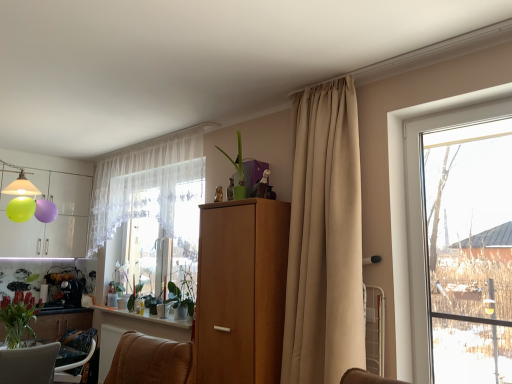
What do you see at coordinates (461, 244) in the screenshot?
I see `transparent glass window at right` at bounding box center [461, 244].

In order to face beige fabric curtain at center, placed as the 2th curtain when sorted from back to front, should I rotate leftwards or rightwards?

You should look right and rotate roughly 7.740 degrees.

The width and height of the screenshot is (512, 384). What do you see at coordinates (324, 239) in the screenshot?
I see `beige fabric curtain at center, the 1th curtain from the front` at bounding box center [324, 239].

Measure the distance between point (31, 304) and camera.

Point (31, 304) and camera are 3.41 meters apart.

Image resolution: width=512 pixels, height=384 pixels. Identify the location of brown leather armchair at lower center, the 2th furniture positioned from the front. (150, 361).

The image size is (512, 384). Find the location of `transparent glass window at right`. transparent glass window at right is located at coordinates (461, 244).

Between brown leather armchair at lower center, the 2th furniture positioned from the front, and translucent fabric at center, which one has larger size?

A: translucent fabric at center is bigger.

Can we say brown leather armchair at lower center, the first furniture in the back-to-front sequence, lies outside translucent fabric at center?

brown leather armchair at lower center, the first furniture in the back-to-front sequence, is positioned outside translucent fabric at center.

Is brown leather armchair at lower center, the 2th furniture positioned from the front, wider or thinner than translucent fabric at center?

Clearly, brown leather armchair at lower center, the 2th furniture positioned from the front, has less width compared to translucent fabric at center.

Considering the sizes of objects white lace curtain at upper center, the 1th curtain from the back, and brown leather armchair at lower center, the 2th furniture positioned from the front, in the image provided, who is smaller, white lace curtain at upper center, the 1th curtain from the back, or brown leather armchair at lower center, the 2th furniture positioned from the front,?

brown leather armchair at lower center, the 2th furniture positioned from the front, is smaller.

Which object is positioned more to the left, white lace curtain at upper center, placed as the 2th curtain when sorted from right to left, or brown leather armchair at lower center, the first furniture in the back-to-front sequence?

From the viewer's perspective, brown leather armchair at lower center, the first furniture in the back-to-front sequence, appears more on the left side.

From a real-world perspective, is white lace curtain at upper center, which is the second curtain from front to back, physically located above or below brown leather armchair at lower center, the 2th furniture positioned from the front?

In terms of real-world spatial position, white lace curtain at upper center, which is the second curtain from front to back, is above brown leather armchair at lower center, the 2th furniture positioned from the front.

You are a GUI agent. You are given a task and a screenshot of the screen. Output one action in this format:
    pyautogui.click(x=<x>, y=<y>)
    Task: Click on the 2nd furniture below the white lace curtain at upper center, which is the second curtain from front to back (from the image's perspective)
    
    Given the screenshot: What is the action you would take?
    pyautogui.click(x=150, y=361)

Is matte brown chair at lower left, the 2th furniture when ordered from back to front, taller or shorter than transparent glass window at right?

In the image, matte brown chair at lower left, the 2th furniture when ordered from back to front, appears to be shorter than transparent glass window at right.

Is matte brown chair at lower left, the 2th furniture when ordered from back to front, to the left of transparent glass window at right from the viewer's perspective?

Correct, you'll find matte brown chair at lower left, the 2th furniture when ordered from back to front, to the left of transparent glass window at right.

From the image's perspective, which one is positioned lower, matte brown chair at lower left, the 2th furniture when ordered from back to front, or transparent glass window at right?

From the image's view, matte brown chair at lower left, the 2th furniture when ordered from back to front, is below.

Considering the sizes of objects matte brown chair at lower left, placed as the first furniture when sorted from front to back, and transparent glass window at right in the image provided, who is wider, matte brown chair at lower left, placed as the first furniture when sorted from front to back, or transparent glass window at right?

With larger width is matte brown chair at lower left, placed as the first furniture when sorted from front to back.

Can you tell me how much transparent glass window at right and green glossy plant at center, the second plant from the right, differ in facing direction?

The angular difference between transparent glass window at right and green glossy plant at center, the second plant from the right, is 1.82 degrees.

Is transparent glass window at right next to green glossy plant at center, positioned as the 1th plant in left-to-right order?

No, transparent glass window at right is not next to green glossy plant at center, positioned as the 1th plant in left-to-right order.

Based on the photo, do you think transparent glass window at right is within green glossy plant at center, the second plant from the right, or outside of it?

transparent glass window at right is spatially situated outside green glossy plant at center, the second plant from the right.

Does transparent glass window at right have a lesser width compared to green glossy plant at center, which ranks as the first plant in back-to-front order?

No, transparent glass window at right is not thinner than green glossy plant at center, which ranks as the first plant in back-to-front order.

What's the angular difference between transparent glass window at right and light brown wood cabinet at center's facing directions?

0.000238 degrees separate the facing orientations of transparent glass window at right and light brown wood cabinet at center.

Does point (504, 376) lie in front of point (245, 226)?

Yes.

At what (x,y) coordinates should I click in order to perform the action: click on window in front of the light brown wood cabinet at center. Please return your answer as a coordinate pair (x, y). Image resolution: width=512 pixels, height=384 pixels. Looking at the image, I should click on (461, 244).

From the picture: Measure the distance from beige fabric curtain at center, marked as the 1th curtain in a right-to-left arrangement, to translucent fabric at center.

beige fabric curtain at center, marked as the 1th curtain in a right-to-left arrangement, and translucent fabric at center are 4.58 feet apart from each other.

From the image's perspective, which is above, beige fabric curtain at center, the 1th curtain from the front, or translucent fabric at center?

beige fabric curtain at center, the 1th curtain from the front, appears higher in the image.

Is beige fabric curtain at center, marked as the 1th curtain in a right-to-left arrangement, taller or shorter than translucent fabric at center?

beige fabric curtain at center, marked as the 1th curtain in a right-to-left arrangement, is taller than translucent fabric at center.

From the image's perspective, which one is positioned higher, green matte plant at lower center, the second plant positioned from the back, or green matte vase at lower left?

From the image's view, green matte plant at lower center, the second plant positioned from the back, is above.

What's the angular difference between green matte plant at lower center, the 1th plant when ordered from right to left, and green matte vase at lower left's facing directions?

The facing directions of green matte plant at lower center, the 1th plant when ordered from right to left, and green matte vase at lower left are 0.391 degrees apart.

I want to click on furniture that is the 2nd one below the translucent fabric at center (from a real-world perspective), so click(x=150, y=361).

Find the location of a particular element. the 2nd curtain positioned above the brown leather armchair at lower center, the first furniture in the back-to-front sequence (from the image's perspective) is located at coordinates (143, 184).

From the image, which object appears to be nearer to matte brown chair at lower left, placed as the first furniture when sorted from front to back, white glossy window sill at lower center or green matte vase at lower left?

Based on the image, green matte vase at lower left appears to be nearer to matte brown chair at lower left, placed as the first furniture when sorted from front to back.

From the image, which object appears to be farther from white lace curtain at upper center, the 1th curtain from the back, beige fabric curtain at center, which appears as the second curtain when viewed from the left, or brown leather armchair at lower center, the first furniture in the back-to-front sequence?

brown leather armchair at lower center, the first furniture in the back-to-front sequence, is positioned further to the anchor white lace curtain at upper center, the 1th curtain from the back.

Estimate the real-world distances between objects in this image. Which object is closer to white glossy window sill at lower center, green glossy plant at center, positioned as the 1th plant in left-to-right order, or white lace curtain at upper center, which ranks as the first curtain in left-to-right order?

green glossy plant at center, positioned as the 1th plant in left-to-right order.

From the image, which object appears to be nearer to brown leather armchair at lower center, the 2th furniture positioned from the front, matte brown chair at lower left, placed as the first furniture when sorted from front to back, or transparent glass window at right?

Based on the image, matte brown chair at lower left, placed as the first furniture when sorted from front to back, appears to be nearer to brown leather armchair at lower center, the 2th furniture positioned from the front.

From the image, which object appears to be farther from translucent fabric at center, green matte plant at lower center, the second plant positioned from the back, or brown leather armchair at lower center, the 2th furniture positioned from the front?

brown leather armchair at lower center, the 2th furniture positioned from the front, is positioned further to the anchor translucent fabric at center.

From the image, which object appears to be farther from transparent glass window at right, green matte plant at lower center, acting as the first plant starting from the front, or green glossy plant at center, positioned as the 1th plant in left-to-right order?

green glossy plant at center, positioned as the 1th plant in left-to-right order, lies further to transparent glass window at right than the other object.

Looking at the image, which one is located closer to light brown wood cabinet at center, matte brown chair at lower left, placed as the first furniture when sorted from front to back, or beige fabric curtain at center, marked as the 1th curtain in a right-to-left arrangement?

Based on the image, beige fabric curtain at center, marked as the 1th curtain in a right-to-left arrangement, appears to be nearer to light brown wood cabinet at center.

In the scene shown: Based on their spatial positions, is green glossy plant at center, which ranks as the first plant in back-to-front order, or light brown wood cabinet at center further from white lace curtain at upper center, which is the second curtain from front to back?

light brown wood cabinet at center lies further to white lace curtain at upper center, which is the second curtain from front to back, than the other object.

Locate an element on the screen. This screenshot has height=384, width=512. plant between white lace curtain at upper center, placed as the 2th curtain when sorted from right to left, and green glossy plant at center, which ranks as the first plant in back-to-front order, from top to bottom is located at coordinates (180, 299).

Locate an element on the screen. curtain between white lace curtain at upper center, which is the second curtain from front to back, and transparent glass window at right, in the horizontal direction is located at coordinates (324, 239).

Locate an element on the screen. The width and height of the screenshot is (512, 384). window screen located between white glossy window sill at lower center and green glossy plant at center, the second plant from the right, in the depth direction is located at coordinates (166, 238).

Locate an element on the screen. The image size is (512, 384). furniture between matte brown chair at lower left, the 2th furniture when ordered from back to front, and transparent glass window at right is located at coordinates (150, 361).